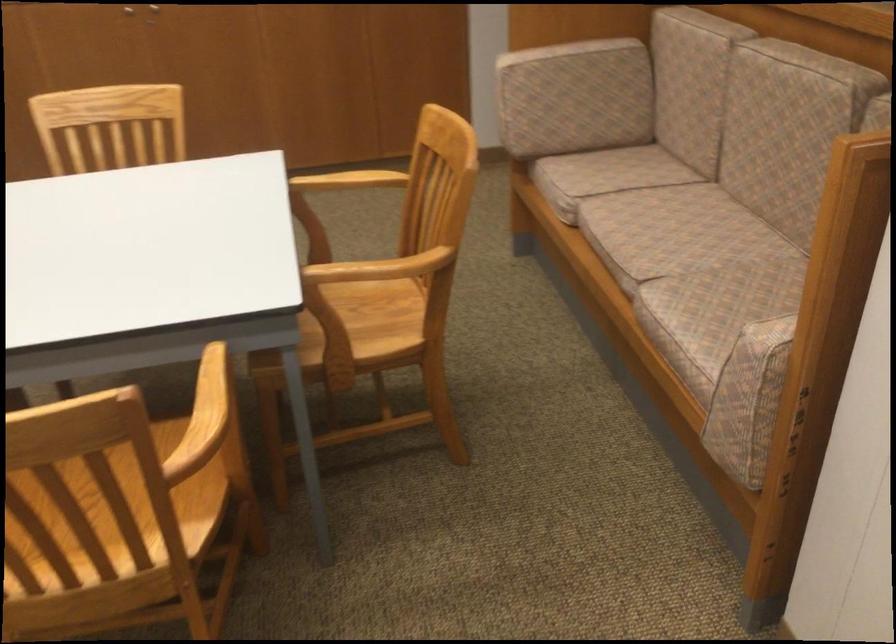
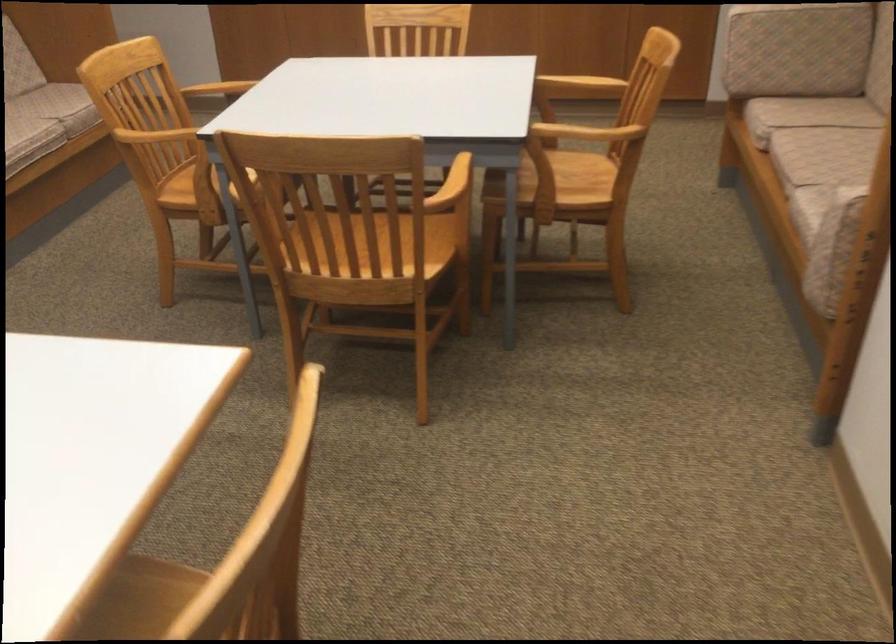
Find the pixel in the second image that matches point (674, 290) in the first image.

(822, 190)